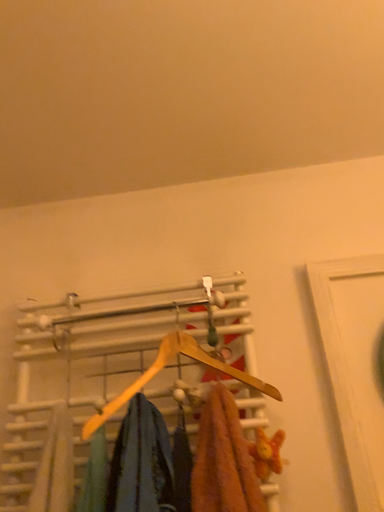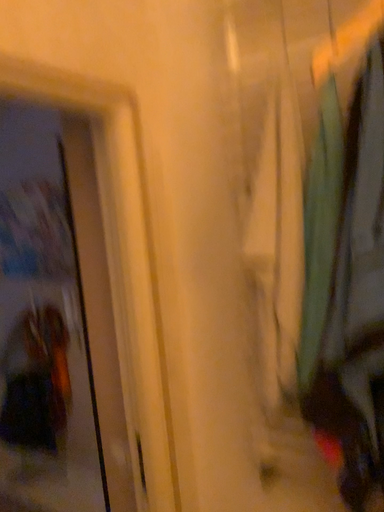
Question: Which way did the camera rotate in the video?

Choices:
 (A) rotated upward
 (B) rotated downward

Answer: (B)